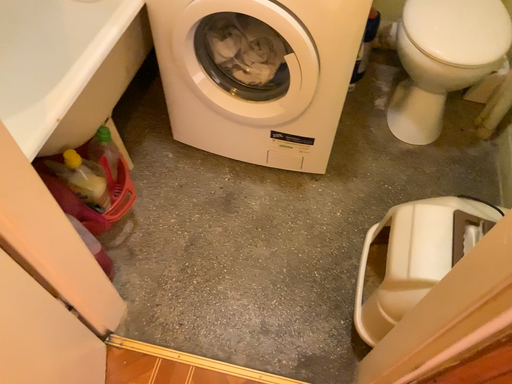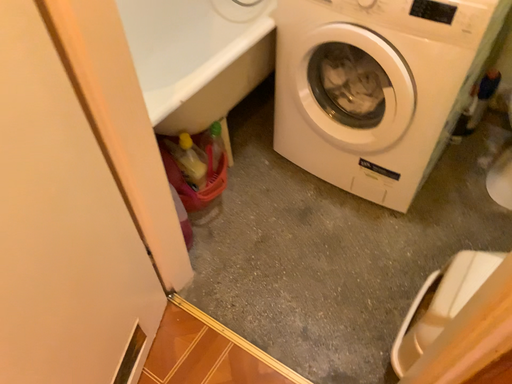
Question: Which way did the camera rotate in the video?

Choices:
 (A) rotated upward
 (B) rotated downward

Answer: (A)